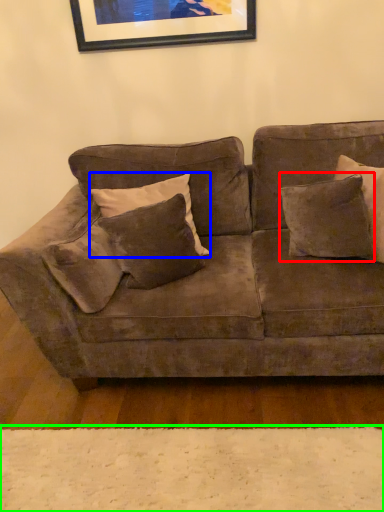
Question: Based on their relative distances, which object is farther from pillow (highlighted by a red box)? Choose from pillow (highlighted by a blue box) and plain (highlighted by a green box).

Choices:
 (A) pillow
 (B) plain

Answer: (B)